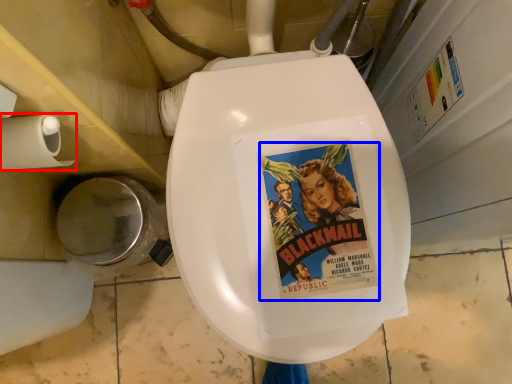
Question: Which of the following is the closest to the observer, toilet paper (highlighted by a red box) or comic book character (highlighted by a blue box)?

Choices:
 (A) toilet paper
 (B) comic book character

Answer: (A)